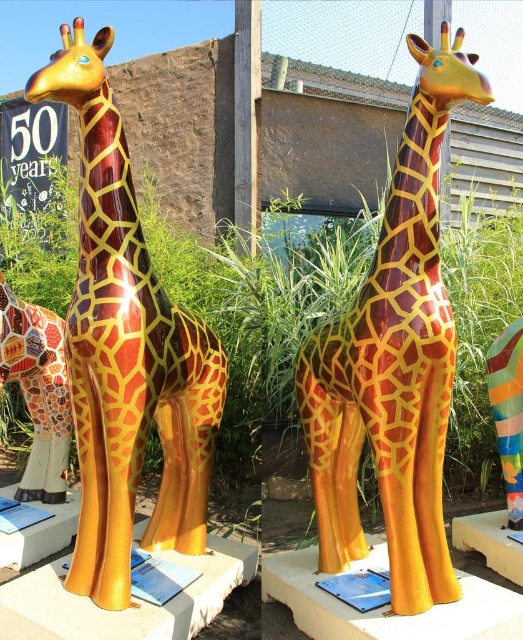
Question: Observing the image, what is the correct spatial positioning of shiny gold giraffe at center in reference to metallic blue plaque at center?

Choices:
 (A) right
 (B) left

Answer: (B)

Question: Which of these objects is positioned farthest from the shiny plastic giraffe at center?

Choices:
 (A) metallic blue plaque at center
 (B) shiny gold giraffe at center
 (C) mosaic-patterned giraffe at left

Answer: (C)

Question: Among these objects, which one is farthest from the camera?

Choices:
 (A) mosaic-patterned giraffe at left
 (B) shiny plastic giraffe at center
 (C) shiny gold giraffe at center

Answer: (A)

Question: Can you confirm if shiny plastic giraffe at center is thinner than metallic blue plaque at center?

Choices:
 (A) yes
 (B) no

Answer: (B)

Question: Can you confirm if shiny plastic giraffe at center is thinner than metallic blue plaque at center?

Choices:
 (A) yes
 (B) no

Answer: (B)

Question: Which of the following is the farthest from the observer?

Choices:
 (A) (157, 564)
 (B) (97, 170)
 (C) (369, 609)

Answer: (A)